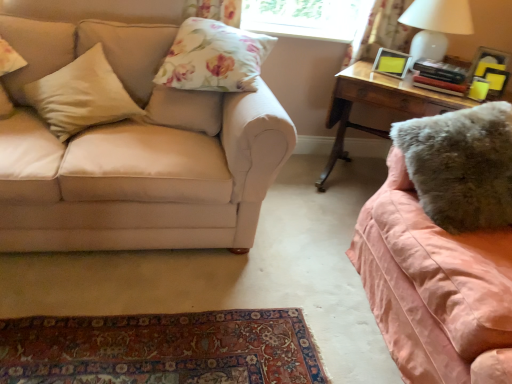
Where is `floral fabric pillow at upper center, which is counted as the second pillow, starting from the right`? floral fabric pillow at upper center, which is counted as the second pillow, starting from the right is located at coordinates (214, 57).

Find the location of a particular element. matte yellow picture frame at upper right is located at coordinates (391, 63).

Image resolution: width=512 pixels, height=384 pixels. Identify the location of beige fabric pillow at left, which appears as the 2th pillow when viewed from the left. (81, 95).

This screenshot has width=512, height=384. Describe the element at coordinates (378, 105) in the screenshot. I see `wooden desk at right` at that location.

The image size is (512, 384). Describe the element at coordinates (134, 153) in the screenshot. I see `beige fabric couch at left, the 2th studio couch when ordered from right to left` at that location.

Where is `floral fabric pillow at upper center, which is counted as the second pillow, starting from the right`? This screenshot has height=384, width=512. floral fabric pillow at upper center, which is counted as the second pillow, starting from the right is located at coordinates (214, 57).

Who is smaller, white glossy table lamp at upper right or beige fabric pillow at left, the 3th pillow from the right?

beige fabric pillow at left, the 3th pillow from the right, is smaller.

Would you say white glossy table lamp at upper right is to the left or to the right of beige fabric pillow at left, which appears as the 2th pillow when viewed from the left, in the picture?

white glossy table lamp at upper right is to the right of beige fabric pillow at left, which appears as the 2th pillow when viewed from the left.

Who is shorter, white glossy table lamp at upper right or beige fabric pillow at left, which appears as the 2th pillow when viewed from the left?

Standing shorter between the two is beige fabric pillow at left, which appears as the 2th pillow when viewed from the left.

Is point (418, 27) closer to camera compared to point (106, 96)?

No, it is not.

Does fuzzy pink blanket at right, which is the first studio couch from right to left, touch matte yellow picture frame at upper right?

No, fuzzy pink blanket at right, which is the first studio couch from right to left, is not touching matte yellow picture frame at upper right.

Is fuzzy pink blanket at right, which is the first studio couch from right to left, oriented away from matte yellow picture frame at upper right?

No.

Measure the distance between fuzzy pink blanket at right, the 2th studio couch positioned from the left, and matte yellow picture frame at upper right.

fuzzy pink blanket at right, the 2th studio couch positioned from the left, and matte yellow picture frame at upper right are 39.32 inches apart.

Can we say fuzzy pink blanket at right, the 2th studio couch positioned from the left, lies outside matte yellow picture frame at upper right?

Yes.

Between beige fabric couch at left, the 2th studio couch when ordered from right to left, and fuzzy pink blanket at right, the 2th studio couch positioned from the left, which one has smaller width?

Thinner between the two is fuzzy pink blanket at right, the 2th studio couch positioned from the left.

Is beige fabric couch at left, the 2th studio couch when ordered from right to left, facing towards fuzzy pink blanket at right, which is the first studio couch from right to left?

No, beige fabric couch at left, the 2th studio couch when ordered from right to left, is not facing towards fuzzy pink blanket at right, which is the first studio couch from right to left.

Based on their sizes in the image, would you say beige fabric couch at left, which is the first studio couch in left-to-right order, is bigger or smaller than fuzzy pink blanket at right, which is the first studio couch from right to left?

Clearly, beige fabric couch at left, which is the first studio couch in left-to-right order, is larger in size than fuzzy pink blanket at right, which is the first studio couch from right to left.

How different are the orientations of beige fabric couch at left, which is the first studio couch in left-to-right order, and fuzzy pink blanket at right, the 2th studio couch positioned from the left, in degrees?

The angle between the facing direction of beige fabric couch at left, which is the first studio couch in left-to-right order, and the facing direction of fuzzy pink blanket at right, the 2th studio couch positioned from the left, is 94.9 degrees.

Between beige fabric pillow at left, which appears as the 2th pillow when viewed from the left, and fuzzy gray pillow at right, marked as the fourth pillow in a left-to-right arrangement, which one has smaller size?

beige fabric pillow at left, which appears as the 2th pillow when viewed from the left, is smaller.

Consider the image. Are beige fabric pillow at left, the 3th pillow from the right, and fuzzy gray pillow at right, the first pillow positioned from the right, located far from each other?

Absolutely, beige fabric pillow at left, the 3th pillow from the right, is distant from fuzzy gray pillow at right, the first pillow positioned from the right.

Does point (104, 98) come closer to viewer compared to point (477, 124)?

No, (104, 98) is further to viewer.

Considering the relative positions of beige fabric pillow at left, which appears as the 2th pillow when viewed from the left, and fuzzy gray pillow at right, the first pillow positioned from the right, in the image provided, is beige fabric pillow at left, which appears as the 2th pillow when viewed from the left, to the left or to the right of fuzzy gray pillow at right, the first pillow positioned from the right,?

Clearly, beige fabric pillow at left, which appears as the 2th pillow when viewed from the left, is on the left of fuzzy gray pillow at right, the first pillow positioned from the right, in the image.

Is floral fabric curtain at upper right inside or outside of fuzzy pink blanket at right, the 2th studio couch positioned from the left?

The correct answer is: outside.

Considering the positions of objects floral fabric curtain at upper right and fuzzy pink blanket at right, which is the first studio couch from right to left, in the image provided, who is behind, floral fabric curtain at upper right or fuzzy pink blanket at right, which is the first studio couch from right to left,?

floral fabric curtain at upper right is behind.

Based on their sizes in the image, would you say floral fabric curtain at upper right is bigger or smaller than fuzzy pink blanket at right, the 2th studio couch positioned from the left?

floral fabric curtain at upper right is smaller than fuzzy pink blanket at right, the 2th studio couch positioned from the left.

Is point (376, 68) positioned before point (444, 101)?

No.

Is matte yellow picture frame at upper right positioned beyond the bounds of wooden desk at right?

matte yellow picture frame at upper right is positioned outside wooden desk at right.

Considering the relative positions of matte yellow picture frame at upper right and wooden desk at right in the image provided, is matte yellow picture frame at upper right to the right of wooden desk at right from the viewer's perspective?

No, matte yellow picture frame at upper right is not to the right of wooden desk at right.

In the scene shown: Considering the relative sizes of fuzzy pink blanket at right, the 2th studio couch positioned from the left, and wooden desk at right in the image provided, is fuzzy pink blanket at right, the 2th studio couch positioned from the left, wider than wooden desk at right?

Correct, the width of fuzzy pink blanket at right, the 2th studio couch positioned from the left, exceeds that of wooden desk at right.

Would you consider fuzzy pink blanket at right, the 2th studio couch positioned from the left, to be distant from wooden desk at right?

They are positioned close to each other.

Consider the image. Which is in front, fuzzy pink blanket at right, the 2th studio couch positioned from the left, or wooden desk at right?

fuzzy pink blanket at right, the 2th studio couch positioned from the left, is more forward.

Which object is positioned more to the left, fuzzy pink blanket at right, which is the first studio couch from right to left, or wooden desk at right?

wooden desk at right.

In order to click on table lamp above the beige fabric pillow at left, which appears as the 2th pillow when viewed from the left (from the image's perspective) in this screenshot , I will do `click(436, 26)`.

Locate an element on the screen. This screenshot has height=384, width=512. picture frame behind the fuzzy pink blanket at right, the 2th studio couch positioned from the left is located at coordinates (391, 63).

Which object lies further to the anchor point fuzzy pink blanket at right, which is the first studio couch from right to left, matte yellow picture frame at upper right or beige fabric pillow at left, positioned as the first pillow in left-to-right order?

beige fabric pillow at left, positioned as the first pillow in left-to-right order, lies further to fuzzy pink blanket at right, which is the first studio couch from right to left, than the other object.

Looking at the image, which one is located further to matte yellow picture frame at upper right, beige fabric couch at left, the 2th studio couch when ordered from right to left, or white glossy table lamp at upper right?

Based on the image, beige fabric couch at left, the 2th studio couch when ordered from right to left, appears to be further to matte yellow picture frame at upper right.

From the image, which object appears to be farther from white glossy table lamp at upper right, beige fabric pillow at left, the 3th pillow from the right, or beige fabric pillow at left, positioned as the first pillow in left-to-right order?

The object further to white glossy table lamp at upper right is beige fabric pillow at left, positioned as the first pillow in left-to-right order.

Considering their positions, is wooden desk at right positioned further to floral fabric curtain at upper right than fuzzy gray pillow at right, the first pillow positioned from the right?

fuzzy gray pillow at right, the first pillow positioned from the right, is further to floral fabric curtain at upper right.

Based on the photo, estimate the real-world distances between objects in this image. Which object is closer to matte yellow picture frame at upper right, white glossy table lamp at upper right or fuzzy gray pillow at right, the first pillow positioned from the right?

Among the two, white glossy table lamp at upper right is located nearer to matte yellow picture frame at upper right.

Based on their spatial positions, is fuzzy pink blanket at right, the 2th studio couch positioned from the left, or floral fabric curtain at upper right further from floral fabric pillow at upper center, which is counted as the second pillow, starting from the right?

Based on the image, floral fabric curtain at upper right appears to be further to floral fabric pillow at upper center, which is counted as the second pillow, starting from the right.

Based on their spatial positions, is white glossy table lamp at upper right or beige fabric couch at left, which is the first studio couch in left-to-right order, further from floral fabric curtain at upper right?

The object further to floral fabric curtain at upper right is beige fabric couch at left, which is the first studio couch in left-to-right order.

When comparing their distances from floral fabric curtain at upper right, does beige fabric pillow at left, the 3th pillow from the right, or fuzzy gray pillow at right, marked as the fourth pillow in a left-to-right arrangement, seem closer?

fuzzy gray pillow at right, marked as the fourth pillow in a left-to-right arrangement.

Find the location of a particular element. This screenshot has height=384, width=512. picture frame located between beige fabric pillow at left, positioned as the first pillow in left-to-right order, and floral fabric curtain at upper right in the left-right direction is located at coordinates pos(391,63).

Locate an element on the screen. studio couch between beige fabric pillow at left, positioned as the first pillow in left-to-right order, and fuzzy pink blanket at right, which is the first studio couch from right to left, from left to right is located at coordinates (134, 153).

The width and height of the screenshot is (512, 384). Find the location of `studio couch between beige fabric pillow at left, marked as the fourth pillow in a right-to-left arrangement, and matte yellow picture frame at upper right, in the horizontal direction`. studio couch between beige fabric pillow at left, marked as the fourth pillow in a right-to-left arrangement, and matte yellow picture frame at upper right, in the horizontal direction is located at coordinates (134, 153).

The image size is (512, 384). I want to click on picture frame located between fuzzy pink blanket at right, the 2th studio couch positioned from the left, and floral fabric curtain at upper right in the depth direction, so click(391, 63).